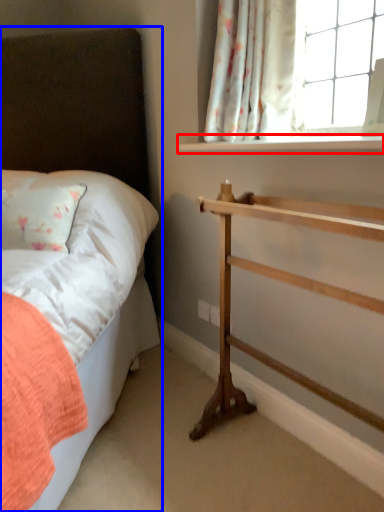
Question: Which object appears farthest to the camera in this image, window sill (highlighted by a red box) or bed (highlighted by a blue box)?

Choices:
 (A) window sill
 (B) bed

Answer: (A)